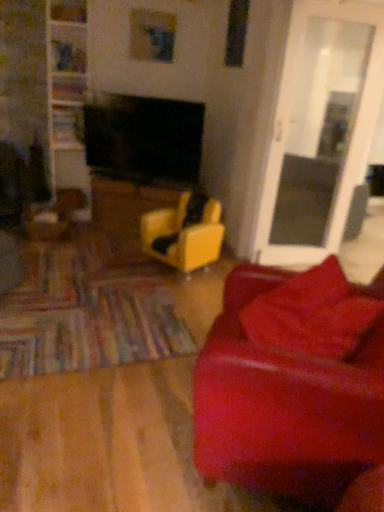
You are a GUI agent. You are given a task and a screenshot of the screen. Output one action in this format:
    pyautogui.click(x=<x>, y=<y>)
    Task: Click on the yellow leather chair at center
    The height and width of the screenshot is (512, 384).
    Given the screenshot: What is the action you would take?
    pyautogui.click(x=183, y=234)

Measure the distance between point (313,339) and camera.

Point (313,339) is 5.22 feet away from camera.

Locate an element on the screen. The image size is (384, 512). leather couch at right is located at coordinates (291, 384).

Is yellow matte table at center oriented away from leather couch at right?

yellow matte table at center does not have its back to leather couch at right.

The image size is (384, 512). Find the location of `table below the leather couch at right (from a real-world perspective)`. table below the leather couch at right (from a real-world perspective) is located at coordinates (127, 207).

Considering the sizes of yellow matte table at center and leather couch at right in the image, is yellow matte table at center wider or thinner than leather couch at right?

Clearly, yellow matte table at center has less width compared to leather couch at right.

How different are the orientations of yellow matte table at center and leather couch at right in degrees?

87.4 degrees.

Consider the image. Is yellow leather chair at center further to the viewer compared to yellow matte table at center?

No, it is not.

Find the location of a particular element. The image size is (384, 512). table above the yellow leather chair at center (from the image's perspective) is located at coordinates (127, 207).

Which object is positioned more to the left, yellow leather chair at center or yellow matte table at center?

From the viewer's perspective, yellow matte table at center appears more on the left side.

Who is shorter, yellow leather chair at center or yellow matte table at center?

Standing shorter between the two is yellow matte table at center.

Is velvet red pillow at lower right not within yellow leather chair at center?

That's correct, velvet red pillow at lower right is outside of yellow leather chair at center.

Can you tell me how much velvet red pillow at lower right and yellow leather chair at center differ in facing direction?

velvet red pillow at lower right and yellow leather chair at center are facing 42.5 degrees away from each other.

Which of these two, velvet red pillow at lower right or yellow leather chair at center, is thinner?

velvet red pillow at lower right is thinner.

Is velvet red pillow at lower right aimed at yellow leather chair at center?

No, velvet red pillow at lower right is not turned towards yellow leather chair at center.

From a real-world perspective, who is located higher, transparent glass door at right or velvet red pillow at lower right?

In real-world perspective, transparent glass door at right is above.

Which is in front, transparent glass door at right or velvet red pillow at lower right?

velvet red pillow at lower right is more forward.

How many degrees apart are the facing directions of transparent glass door at right and velvet red pillow at lower right?

transparent glass door at right and velvet red pillow at lower right are facing 8.98 degrees away from each other.

Which is behind, point (307, 128) or point (295, 274)?

Positioned behind is point (307, 128).

From the picture: Is leather couch at right beside velvet red pillow at lower right?

There is a gap between leather couch at right and velvet red pillow at lower right.

From a real-world perspective, is leather couch at right located higher than velvet red pillow at lower right?

No, from a real-world perspective, leather couch at right is not above velvet red pillow at lower right.

This screenshot has width=384, height=512. I want to click on pillow located behind the leather couch at right, so click(313, 314).

Considering the positions of objects leather couch at right and velvet red pillow at lower right in the image provided, who is in front, leather couch at right or velvet red pillow at lower right?

leather couch at right is more forward.

How different are the orientations of velvet red pillow at lower right and transparent glass door at right in degrees?

8.98 degrees separate the facing orientations of velvet red pillow at lower right and transparent glass door at right.

Is velvet red pillow at lower right not within transparent glass door at right?

Yes.

Is velvet red pillow at lower right thinner than transparent glass door at right?

In fact, velvet red pillow at lower right might be wider than transparent glass door at right.

Which of these two, velvet red pillow at lower right or transparent glass door at right, stands shorter?

velvet red pillow at lower right is shorter.

Considering the relative sizes of yellow leather chair at center and leather couch at right in the image provided, is yellow leather chair at center bigger than leather couch at right?

Actually, yellow leather chair at center might be smaller than leather couch at right.

Is yellow leather chair at center wider than leather couch at right?

Incorrect, the width of yellow leather chair at center does not surpass that of leather couch at right.

What are the coordinates of `chair directly beneath the leather couch at right (from a real-world perspective)` in the screenshot? It's located at (x=183, y=234).

Based on their positions, is yellow leather chair at center located to the left or right of leather couch at right?

Clearly, yellow leather chair at center is on the left of leather couch at right in the image.

You are a GUI agent. You are given a task and a screenshot of the screen. Output one action in this format:
    pyautogui.click(x=<x>, y=<y>)
    Task: Click on the studio couch in front of the yellow matte table at center
    The width and height of the screenshot is (384, 512).
    Given the screenshot: What is the action you would take?
    pyautogui.click(x=291, y=384)

There is a yellow matte table at center. Find the location of `chair above it (from a real-world perspective)`. chair above it (from a real-world perspective) is located at coordinates (183, 234).

Based on their spatial positions, is leather couch at right or transparent glass door at right further from velvet red pillow at lower right?

transparent glass door at right is further to velvet red pillow at lower right.

Looking at the image, which one is located further to transparent glass door at right, yellow matte table at center or leather couch at right?

Based on the image, leather couch at right appears to be further to transparent glass door at right.

Considering their positions, is velvet red pillow at lower right positioned further to leather couch at right than yellow leather chair at center?

The object further to leather couch at right is yellow leather chair at center.

When comparing their distances from velvet red pillow at lower right, does yellow leather chair at center or leather couch at right seem closer?

The object closer to velvet red pillow at lower right is leather couch at right.

Based on their spatial positions, is yellow leather chair at center or yellow matte table at center further from transparent glass door at right?

yellow matte table at center is further to transparent glass door at right.

Estimate the real-world distances between objects in this image. Which object is closer to yellow leather chair at center, transparent glass door at right or yellow matte table at center?

yellow matte table at center lies closer to yellow leather chair at center than the other object.

Consider the image. Considering their positions, is velvet red pillow at lower right positioned closer to yellow leather chair at center than leather couch at right?

velvet red pillow at lower right is closer to yellow leather chair at center.

When comparing their distances from transparent glass door at right, does leather couch at right or yellow leather chair at center seem further?

leather couch at right is positioned further to the anchor transparent glass door at right.

Where is `glass door between leather couch at right and yellow leather chair at center in the front-back direction`? This screenshot has width=384, height=512. glass door between leather couch at right and yellow leather chair at center in the front-back direction is located at coordinates (320, 117).

Locate an element on the screen. Image resolution: width=384 pixels, height=512 pixels. pillow between transparent glass door at right and leather couch at right from top to bottom is located at coordinates (313, 314).

Where is `chair positioned between leather couch at right and yellow matte table at center from near to far`? This screenshot has height=512, width=384. chair positioned between leather couch at right and yellow matte table at center from near to far is located at coordinates (183, 234).

I want to click on glass door between leather couch at right and yellow matte table at center along the z-axis, so click(x=320, y=117).